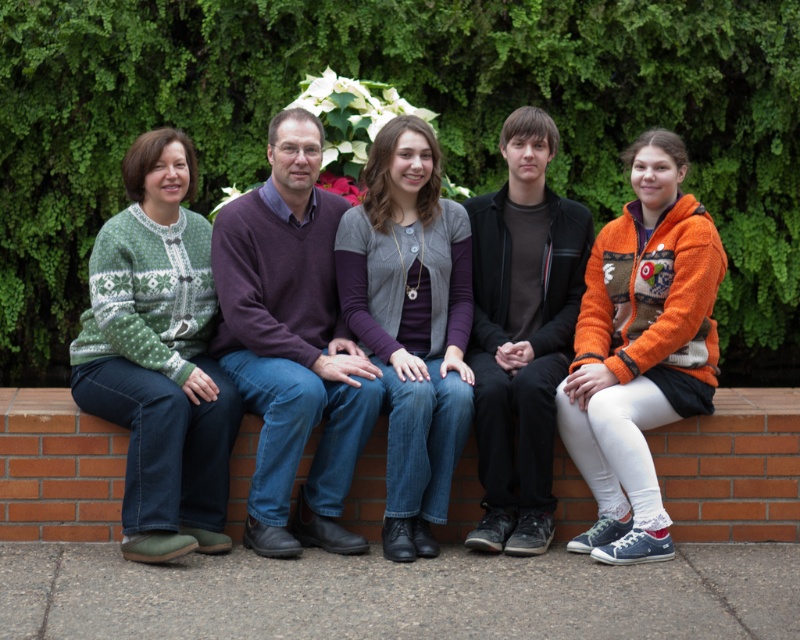
Who is more forward, (752, 454) or (558, 385)?

Point (558, 385)

Is point (38, 506) behind point (708, 244)?

No, (38, 506) is in front of (708, 244).

Where is `brick at center`? brick at center is located at coordinates [x=733, y=467].

Identify the location of brick at center. (733, 467).

Between green knitted sweater at left and brick at center, which one appears on the right side from the viewer's perspective?

green knitted sweater at left is more to the right.

Between green knitted sweater at left and brick at center, which one has more height?

green knitted sweater at left

What do you see at coordinates (389, 305) in the screenshot?
I see `green knitted sweater at left` at bounding box center [389, 305].

Locate an element on the screen. The height and width of the screenshot is (640, 800). green knitted sweater at left is located at coordinates click(389, 305).

Can you confirm if green knitted sweater at left is smaller than orange fuzzy sweater at right?

No, green knitted sweater at left is not smaller than orange fuzzy sweater at right.

Find the location of a particular element. The width and height of the screenshot is (800, 640). green knitted sweater at left is located at coordinates (389, 305).